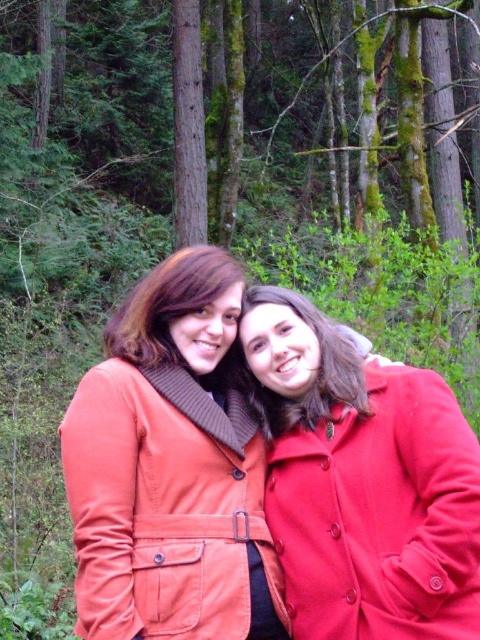
Question: Can you confirm if matte red coat at center is thinner than matte brown hair at center?

Choices:
 (A) no
 (B) yes

Answer: (A)

Question: Among these objects, which one is nearest to the camera?

Choices:
 (A) matte orange coat at center
 (B) matte brown hair at center
 (C) matte red coat at center

Answer: (C)

Question: Which point is farther to the camera?

Choices:
 (A) matte orange coat at center
 (B) matte red coat at center
 (C) matte brown hair at center

Answer: (C)

Question: Which is nearer to the matte orange coat at center?

Choices:
 (A) matte brown hair at center
 (B) matte red coat at center

Answer: (B)

Question: Does matte orange coat at center have a smaller size compared to matte red coat at center?

Choices:
 (A) yes
 (B) no

Answer: (B)

Question: Does matte red coat at center have a greater width compared to matte brown hair at center?

Choices:
 (A) no
 (B) yes

Answer: (B)